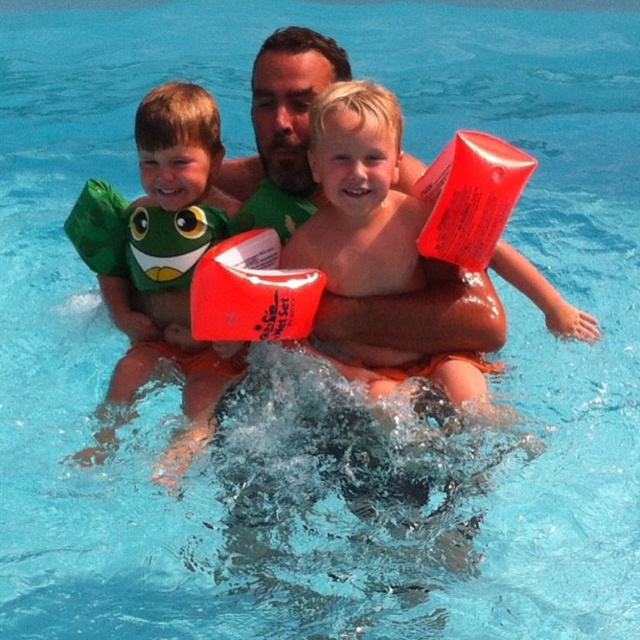
From the picture: Between green rubber arm band at left and matte green swimsuit at center, which one has less height?

With less height is matte green swimsuit at center.

Does green rubber arm band at left have a smaller size compared to matte green swimsuit at center?

→ No, green rubber arm band at left is not smaller than matte green swimsuit at center.

Is point (182, 403) behind point (260, 129)?

No, it is in front of (260, 129).

The image size is (640, 640). I want to click on green rubber arm band at left, so click(156, 204).